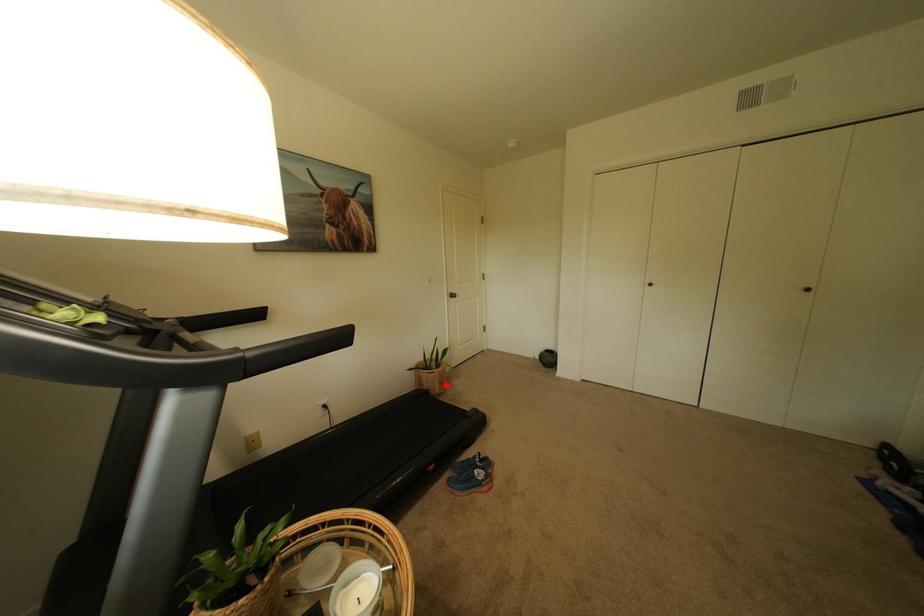
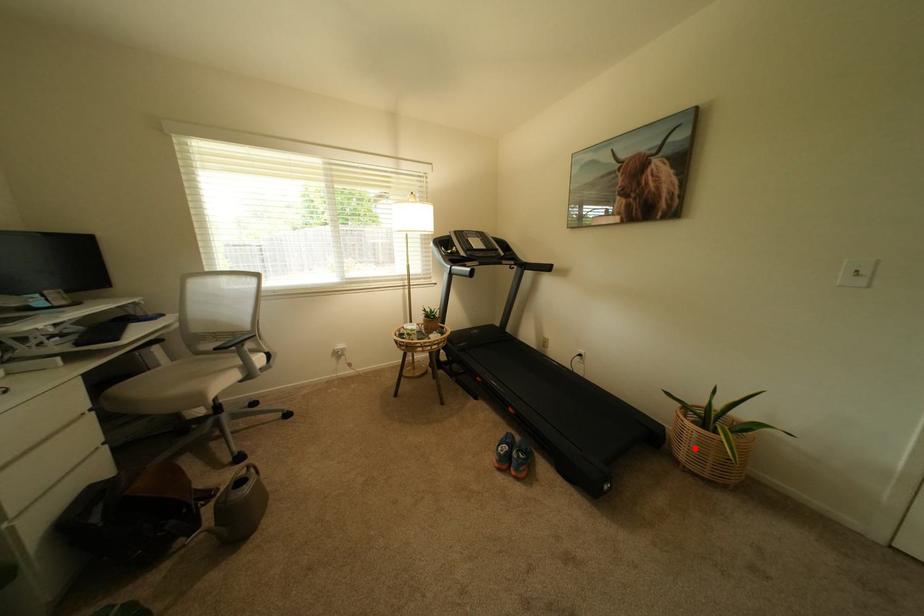
I am providing you with two images of the same scene from different viewpoints. A red point is marked on the first image and another point is marked on the second image. Are the points marked in image1 and image2 representing the same 3D position?

Yes